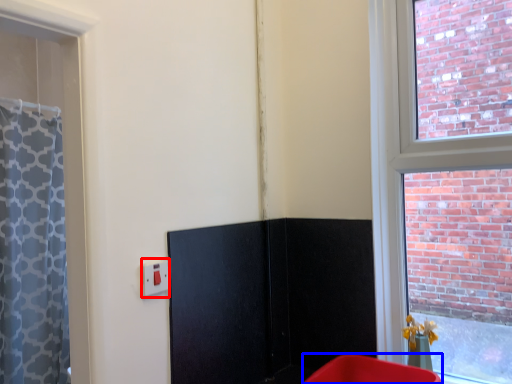
Question: Which object appears closest to the camera in this image, electric outlet (highlighted by a red box) or furniture (highlighted by a blue box)?

Choices:
 (A) electric outlet
 (B) furniture

Answer: (B)